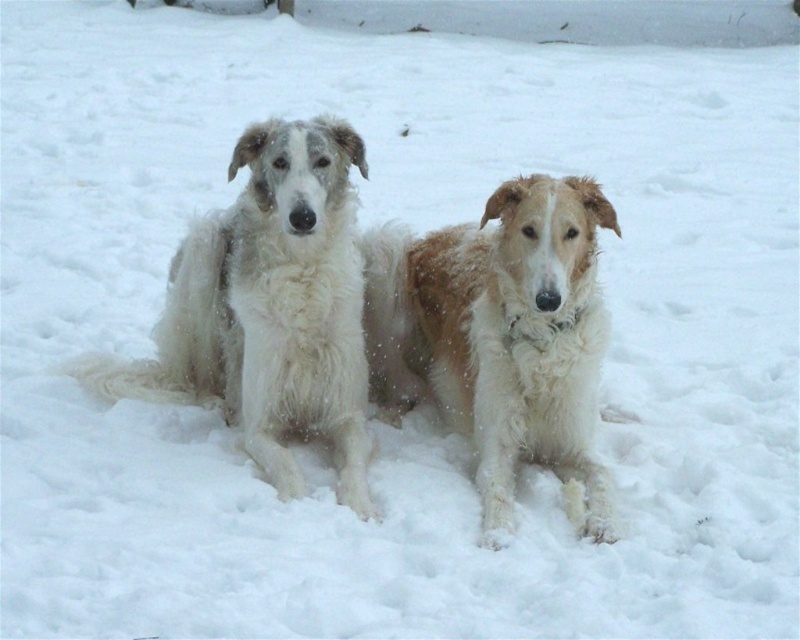
You are a photographer trying to capture a clear shot of the dogs. The camera is focused at point (501, 337). Which dog will be in focus?

The camera is focused on point (501, 337) which corresponds to the fuzzy white dog at center, so the fuzzy white dog at center will be in focus.

You are standing in the snowy area and see the fuzzy white dog at center and the white fluffy dog at left. Which dog is closer to your right side?

The fuzzy white dog at center is to the right of the white fluffy dog at left, so the fuzzy white dog at center is closer to your right side.

You are standing at the origin point in the image. Which direction should you move to reach the fuzzy white dog at center?

To reach the fuzzy white dog at center, you should move towards the point at 0.528 on the x axis and 0.627 on the y axis.